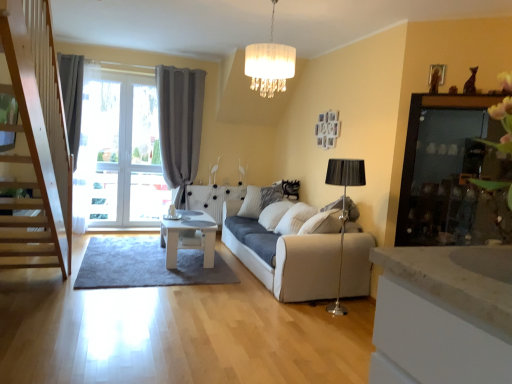
Question: From the image's perspective, is white glossy table at center positioned above or below gray fabric curtain at left?

Choices:
 (A) above
 (B) below

Answer: (B)

Question: Is white glossy table at center situated inside gray fabric curtain at left or outside?

Choices:
 (A) outside
 (B) inside

Answer: (A)

Question: Estimate the real-world distances between objects in this image. Which object is farther from the white glossy table at center?

Choices:
 (A) gray fabric curtain at left
 (B) white fabric chandelier at upper center
 (C) white fabric studio couch at center
 (D) white textured pillow at center
 (E) transparent glass screen door at upper right

Answer: (E)

Question: Which object is the closest to the gray fabric curtain at left?

Choices:
 (A) transparent glass screen door at upper right
 (B) white fabric chandelier at upper center
 (C) white fabric studio couch at center
 (D) white textured pillow at center
 (E) white glossy table at center

Answer: (D)